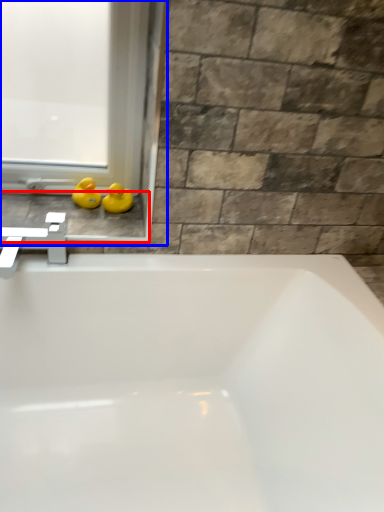
Question: Which object is closer to the camera taking this photo, window sill (highlighted by a red box) or window frame (highlighted by a blue box)?

Choices:
 (A) window sill
 (B) window frame

Answer: (B)